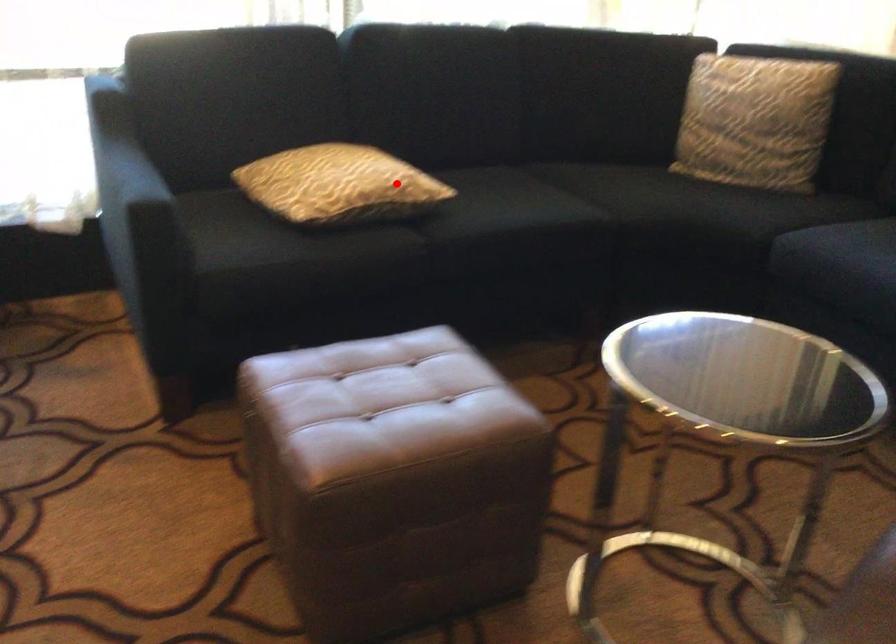
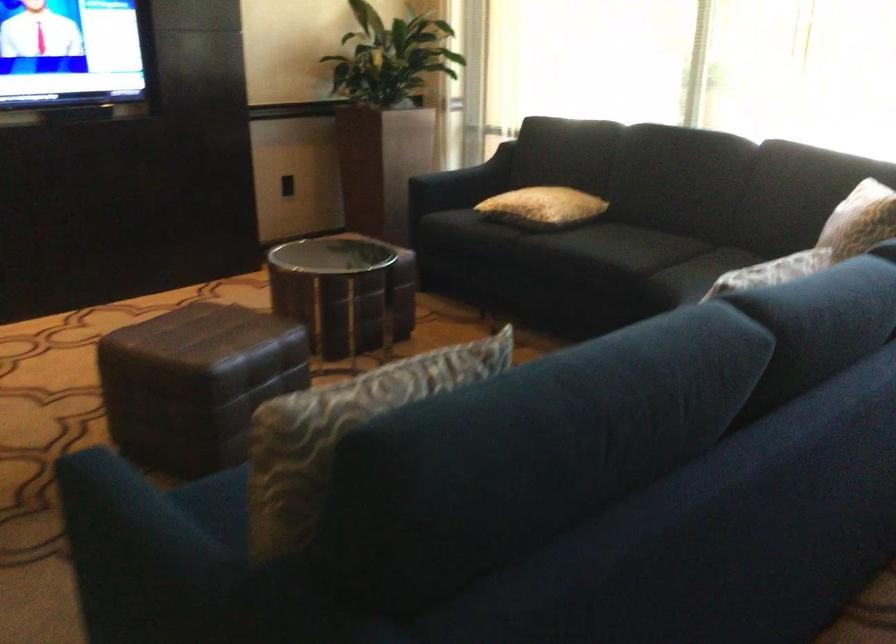
Question: I am providing you with two images of the same scene from different viewpoints. A red point is shown in image1. For the corresponding object point in image2, is it positioned nearer or farther from the camera?

Choices:
 (A) Nearer
 (B) Farther

Answer: (B)